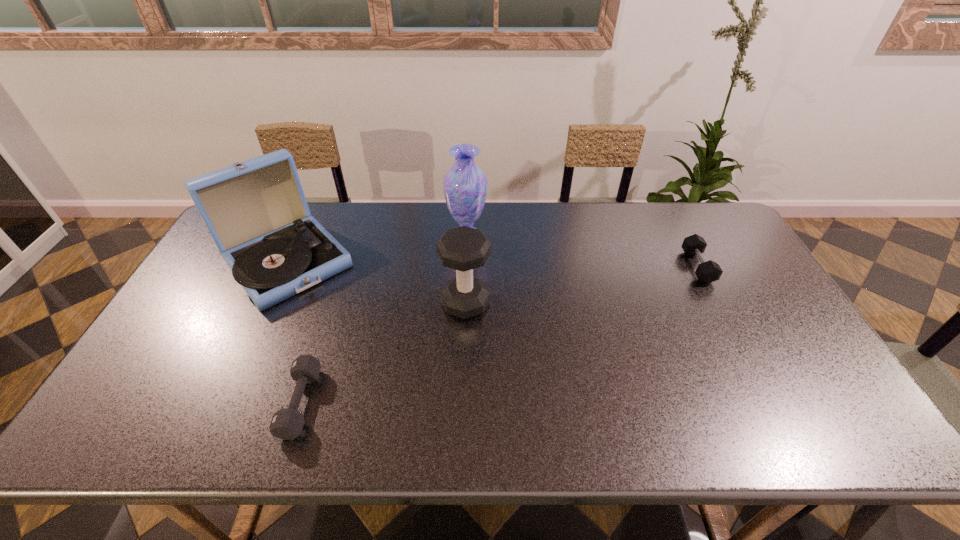
I want to click on free spot at the near edge of the desktop, so point(502,411).

You are a GUI agent. You are given a task and a screenshot of the screen. Output one action in this format:
    pyautogui.click(x=<x>, y=<y>)
    Task: Click on the free location at the left edge
    The height and width of the screenshot is (540, 960).
    Given the screenshot: What is the action you would take?
    pyautogui.click(x=234, y=283)

The height and width of the screenshot is (540, 960). In order to click on vacant space at the right edge in this screenshot , I will do `click(775, 319)`.

Identify the location of vacant space at the far right corner. (680, 218).

This screenshot has width=960, height=540. I want to click on vacant space that is in between the vase and the rightmost dumbbell, so click(x=582, y=252).

The height and width of the screenshot is (540, 960). In order to click on free space that is in between the rightmost dumbbell and the vase in this screenshot , I will do `click(582, 252)`.

Where is `free space between the vase and the leftmost dumbbell`? free space between the vase and the leftmost dumbbell is located at coordinates (384, 320).

Where is `unoccupied position between the vase and the rightmost dumbbell`? This screenshot has height=540, width=960. unoccupied position between the vase and the rightmost dumbbell is located at coordinates (582, 252).

Image resolution: width=960 pixels, height=540 pixels. I want to click on free spot between the rightmost dumbbell and the second dumbbell from right to left, so pos(582,285).

The width and height of the screenshot is (960, 540). I want to click on unoccupied position between the tallest dumbbell and the farthest dumbbell, so [x=582, y=285].